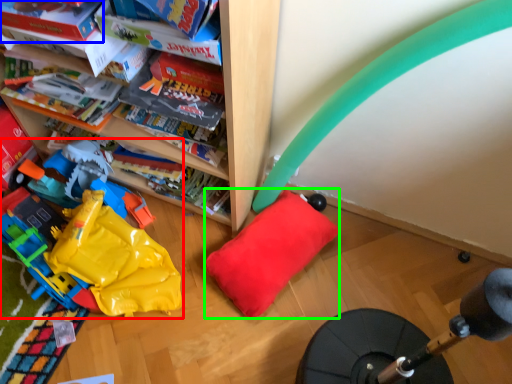
Question: Which object is the farthest from toy (highlighted by a red box)? Choose among these: book (highlighted by a blue box) or pillow (highlighted by a green box).

Choices:
 (A) book
 (B) pillow

Answer: (A)